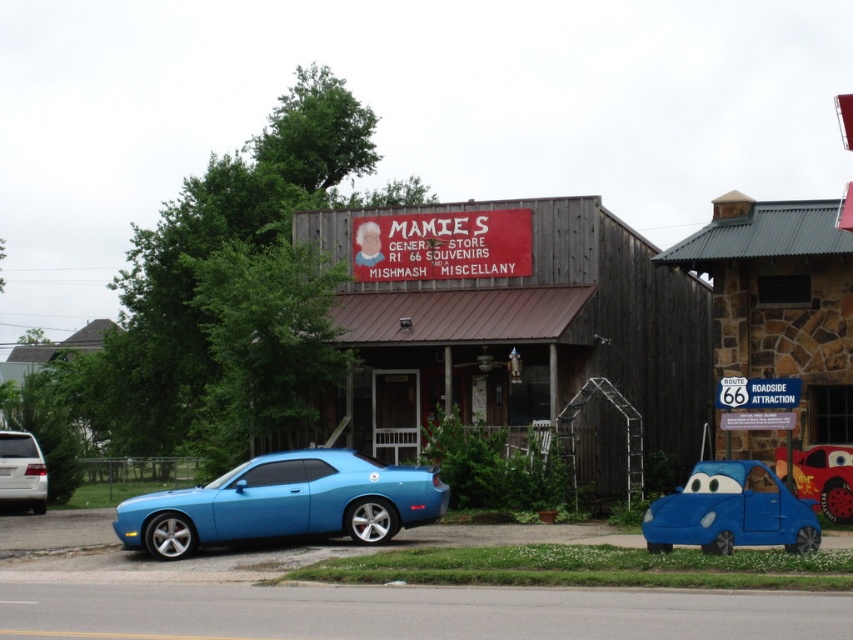
Question: Does blue matte car at center have a lesser width compared to matte blue car at center?

Choices:
 (A) no
 (B) yes

Answer: (A)

Question: Based on their relative distances, which object is farther from the matte blue car at center?

Choices:
 (A) white matte van at left
 (B) wooden signboard at center
 (C) matte blue car at lower left
 (D) blue matte car at center

Answer: (A)

Question: Estimate the real-world distances between objects in this image. Which object is farther from the blue matte car at center?

Choices:
 (A) matte blue car at lower left
 (B) wooden signboard at center
 (C) white matte van at left
 (D) matte blue car at center

Answer: (C)

Question: Which of these objects is positioned farthest from the blue matte car at center?

Choices:
 (A) wooden signboard at center
 (B) matte blue car at lower left

Answer: (A)

Question: Is matte blue car at center above white matte van at left?

Choices:
 (A) yes
 (B) no

Answer: (A)

Question: Can you confirm if matte blue car at lower left is positioned to the left of white matte van at left?

Choices:
 (A) no
 (B) yes

Answer: (A)